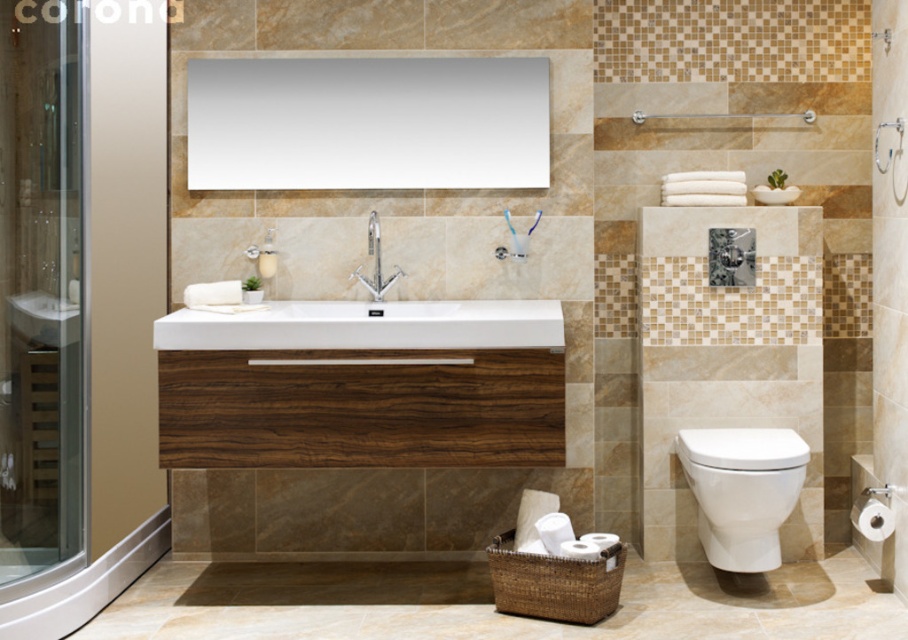
Can you confirm if transparent glass shower door at left is smaller than transparent glass screen door at right?

No.

Is point (72, 400) positioned in front of point (874, 224)?

Yes, it is.

Identify the location of transparent glass shower door at left. This screenshot has width=908, height=640. (40, 292).

Who is taller, white glossy sink at center or white glossy toilet at lower right?

With more height is white glossy sink at center.

Is point (390, 308) more distant than point (746, 516)?

That is True.

What do you see at coordinates (383, 292) in the screenshot? The image size is (908, 640). I see `white glossy sink at center` at bounding box center [383, 292].

The height and width of the screenshot is (640, 908). Find the location of `white glossy sink at center`. white glossy sink at center is located at coordinates (383, 292).

Who is shorter, transparent glass shower door at left or matte wood shower at upper center?

matte wood shower at upper center

Is point (16, 60) positioned after point (697, 116)?

No, (16, 60) is closer to viewer.

At what (x,y) coordinates should I click in order to perform the action: click on transparent glass shower door at left. Please return your answer as a coordinate pair (x, y). Looking at the image, I should click on (40, 292).

Where is `transparent glass shower door at left`? The width and height of the screenshot is (908, 640). transparent glass shower door at left is located at coordinates (40, 292).